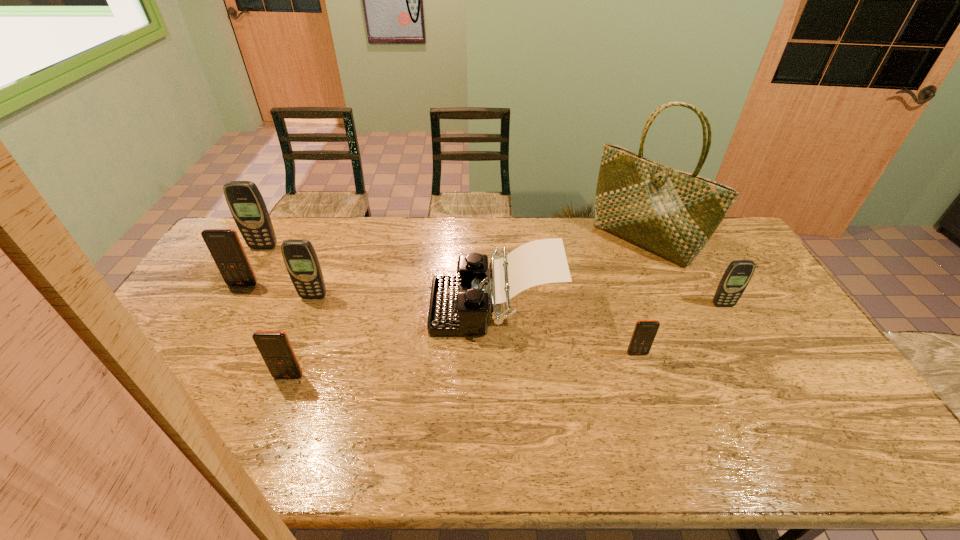
Find the location of `blank space at the near edge of the desktop`. blank space at the near edge of the desktop is located at coordinates pyautogui.click(x=376, y=454).

Find the location of `vacant space at the right edge`. vacant space at the right edge is located at coordinates (819, 392).

You are a GUI agent. You are given a task and a screenshot of the screen. Output one action in this format:
    pyautogui.click(x=<x>, y=<y>)
    Task: Click on the vacant space at the near right corner
    Image resolution: width=960 pixels, height=540 pixels.
    Given the screenshot: What is the action you would take?
    pyautogui.click(x=879, y=440)

You are a GUI agent. You are given a task and a screenshot of the screen. Output one action in this format:
    pyautogui.click(x=<x>, y=<y>)
    Task: Click on the empty space between the leftmost orange cellular telephone and the tallest object
    This screenshot has height=540, width=960.
    Given the screenshot: What is the action you would take?
    pyautogui.click(x=443, y=262)

What are the coordinates of `vacant space that's between the tallest object and the second farthest cellular telephone` in the screenshot? It's located at (443, 262).

Where is `free space between the nearest cellular telephone and the fourth object from right to left`? free space between the nearest cellular telephone and the fourth object from right to left is located at coordinates (392, 341).

Locate an element on the screen. The image size is (960, 540). unoccupied area between the leftmost gray cellular telephone and the farthest orange cellular telephone is located at coordinates (253, 266).

The image size is (960, 540). What are the coordinates of `vacant space that is in between the seventh farthest object and the fourth farthest cellular telephone` in the screenshot? It's located at (x=680, y=329).

Select which object appears as the fifth closest to the second smallest gray cellular telephone. Please provide its 2D coordinates. Your answer should be formatted as a tuple, i.e. [(x, y)], where the tuple contains the x and y coordinates of a point satisfying the conditions above.

[(671, 213)]

Point out which object is positioned as the fifth nearest to the farthest orange cellular telephone. Please provide its 2D coordinates. Your answer should be formatted as a tuple, i.e. [(x, y)], where the tuple contains the x and y coordinates of a point satisfying the conditions above.

[(671, 213)]